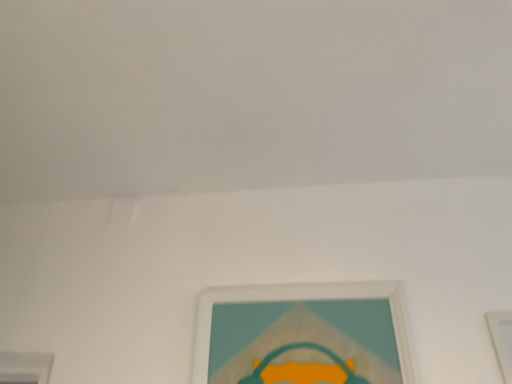
Question: Is white matte picture frame at lower right, arranged as the 1th picture frame when viewed from the right, inside the boundaries of white matte picture frame at center, marked as the second picture frame in a right-to-left arrangement, or outside?

Choices:
 (A) inside
 (B) outside

Answer: (B)

Question: Relative to white matte picture frame at center, marked as the second picture frame in a right-to-left arrangement, is white matte picture frame at lower right, the 2th picture frame when ordered from left to right, in front or behind?

Choices:
 (A) behind
 (B) front

Answer: (B)

Question: In terms of height, does white matte picture frame at lower right, the 2th picture frame when ordered from left to right, look taller or shorter compared to white matte picture frame at center, the first picture frame when ordered from left to right?

Choices:
 (A) tall
 (B) short

Answer: (A)

Question: In the image, is white matte picture frame at center, marked as the second picture frame in a right-to-left arrangement, on the left side or the right side of white matte picture frame at lower right, arranged as the 1th picture frame when viewed from the right?

Choices:
 (A) left
 (B) right

Answer: (A)

Question: In terms of height, does white matte picture frame at center, marked as the second picture frame in a right-to-left arrangement, look taller or shorter compared to white matte picture frame at lower right, arranged as the 1th picture frame when viewed from the right?

Choices:
 (A) tall
 (B) short

Answer: (B)

Question: Considering the positions of white matte picture frame at center, the first picture frame when ordered from left to right, and white matte picture frame at lower right, the 2th picture frame when ordered from left to right, in the image, is white matte picture frame at center, the first picture frame when ordered from left to right, bigger or smaller than white matte picture frame at lower right, the 2th picture frame when ordered from left to right,?

Choices:
 (A) big
 (B) small

Answer: (A)

Question: From the image's perspective, is white matte picture frame at center, marked as the second picture frame in a right-to-left arrangement, above or below white matte picture frame at lower right, arranged as the 1th picture frame when viewed from the right?

Choices:
 (A) below
 (B) above

Answer: (B)